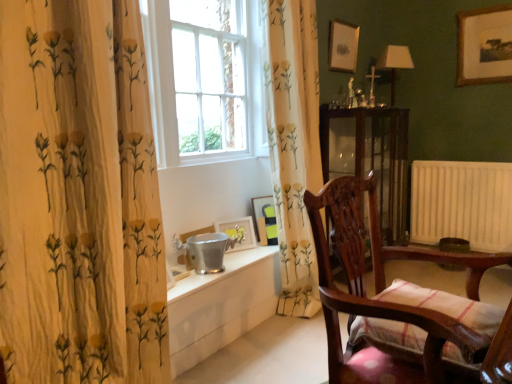
Question: Can you confirm if wooden framed picture at upper right, the fifth picture frame positioned from the bottom, is shorter than matte white lampshade at right?

Choices:
 (A) yes
 (B) no

Answer: (B)

Question: Is wooden framed picture at upper right, which is the 1th picture frame in top-to-bottom order, wider than matte white lampshade at right?

Choices:
 (A) yes
 (B) no

Answer: (B)

Question: Is the depth of wooden framed picture at upper right, which is the 1th picture frame in top-to-bottom order, less than that of matte white lampshade at right?

Choices:
 (A) no
 (B) yes

Answer: (B)

Question: Is wooden framed picture at upper right, which is the 5th picture frame from left to right, facing away from matte white lampshade at right?

Choices:
 (A) no
 (B) yes

Answer: (A)

Question: Does wooden framed picture at upper right, which ranks as the first picture frame in right-to-left order, lie behind matte white lampshade at right?

Choices:
 (A) yes
 (B) no

Answer: (B)

Question: Can matte white lampshade at right be found inside wooden framed picture at upper right, which is the 1th picture frame in top-to-bottom order?

Choices:
 (A) no
 (B) yes

Answer: (A)

Question: Is white floral-patterned curtain at left, the second curtain viewed from the back, thinner than wooden framed picture at upper right, the fifth picture frame positioned from the bottom?

Choices:
 (A) yes
 (B) no

Answer: (B)

Question: Can you confirm if white floral-patterned curtain at left, which is counted as the 1th curtain, starting from the left, is positioned to the right of wooden framed picture at upper right, which is the 5th picture frame from left to right?

Choices:
 (A) yes
 (B) no

Answer: (B)

Question: Is white floral-patterned curtain at left, which is counted as the 1th curtain, starting from the left, not near wooden framed picture at upper right, which is the 5th picture frame from left to right?

Choices:
 (A) no
 (B) yes

Answer: (B)

Question: Could you tell me if white floral-patterned curtain at left, the second curtain positioned from the right, is facing wooden framed picture at upper right, which is the 1th picture frame in top-to-bottom order?

Choices:
 (A) yes
 (B) no

Answer: (B)

Question: Considering the relative positions of white floral-patterned curtain at left, which is counted as the 1th curtain, starting from the left, and wooden framed picture at upper right, which is the 5th picture frame from left to right, in the image provided, is white floral-patterned curtain at left, which is counted as the 1th curtain, starting from the left, to the left of wooden framed picture at upper right, which is the 5th picture frame from left to right, from the viewer's perspective?

Choices:
 (A) yes
 (B) no

Answer: (A)

Question: Is white floral-patterned curtain at left, the second curtain positioned from the right, surrounding wooden framed picture at upper right, which is the 1th picture frame in top-to-bottom order?

Choices:
 (A) no
 (B) yes

Answer: (A)

Question: From the image's perspective, is transparent glass cabinet at center below matte white picture frame at upper center, which ranks as the fourth picture frame in left-to-right order?

Choices:
 (A) yes
 (B) no

Answer: (A)